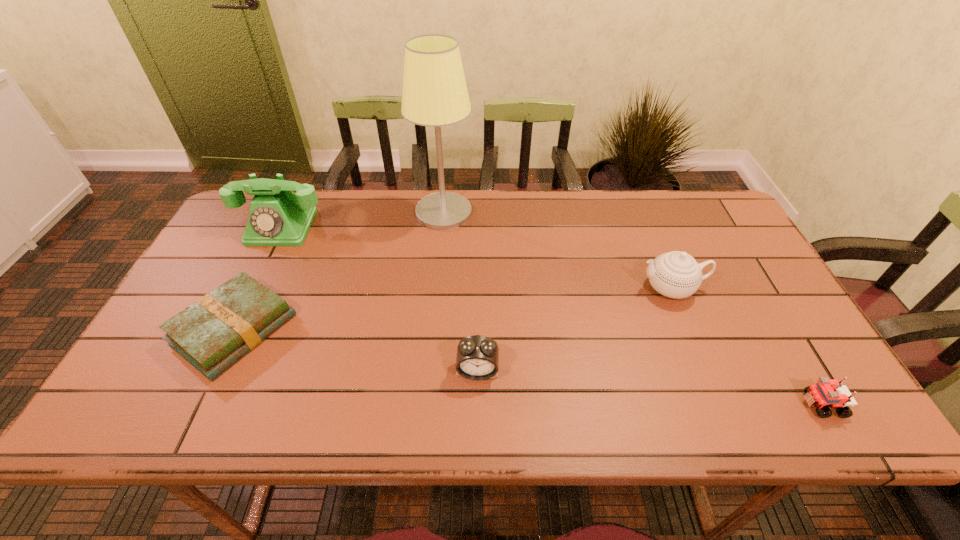
This screenshot has height=540, width=960. I want to click on free space that is in between the alarm clock and the Lego, so click(650, 388).

Locate an element on the screen. Image resolution: width=960 pixels, height=540 pixels. empty location between the tallest object and the shortest object is located at coordinates (339, 271).

The image size is (960, 540). Identify the location of vacant point located between the second object from right to left and the fifth shortest object. (476, 258).

Locate an element on the screen. The width and height of the screenshot is (960, 540). free space between the nearest object and the table lamp is located at coordinates (633, 308).

The height and width of the screenshot is (540, 960). In order to click on free spot between the nearest object and the tallest object in this screenshot , I will do `click(633, 308)`.

Find the location of a particular element. This screenshot has width=960, height=540. empty space that is in between the rightmost object and the second tallest object is located at coordinates (552, 316).

Where is `free space between the fourth tallest object and the shortest object`? Image resolution: width=960 pixels, height=540 pixels. free space between the fourth tallest object and the shortest object is located at coordinates (355, 350).

The height and width of the screenshot is (540, 960). In order to click on free space between the shortest object and the alarm clock in this screenshot , I will do `click(355, 350)`.

Image resolution: width=960 pixels, height=540 pixels. I want to click on blank region between the telephone and the table lamp, so click(x=363, y=220).

This screenshot has height=540, width=960. In order to click on free spot between the third shortest object and the Lego in this screenshot , I will do `click(650, 388)`.